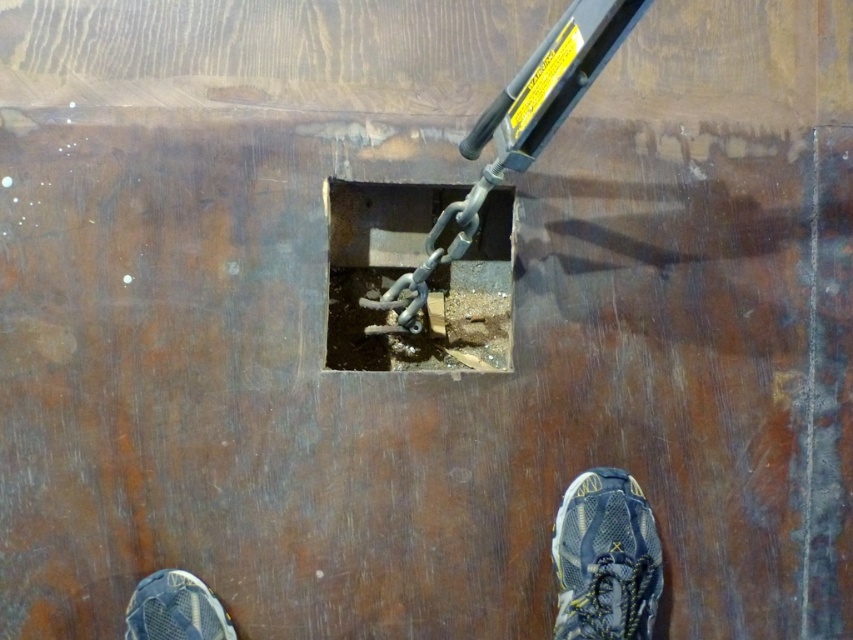
Who is taller, rusty metal hole at center or blue mesh shoe at lower left?

Standing taller between the two is rusty metal hole at center.

Can you confirm if rusty metal hole at center is bigger than blue mesh shoe at lower left?

Yes.

Does point (416, 193) come in front of point (167, 576)?

No, it is not.

At what (x,y) coordinates should I click in order to perform the action: click on rusty metal hole at center. Please return your answer as a coordinate pair (x, y). The width and height of the screenshot is (853, 640). Looking at the image, I should click on (410, 269).

You are a GUI agent. You are given a task and a screenshot of the screen. Output one action in this format:
    pyautogui.click(x=<x>, y=<y>)
    Task: Click on the blue mesh shoe at lower center
    
    Given the screenshot: What is the action you would take?
    pyautogui.click(x=605, y=557)

Who is more distant from viewer, (569,499) or (219,620)?

The point (569,499) is more distant.

Is point (614, 512) behind point (158, 628)?

Yes, point (614, 512) is farther from viewer.

In order to click on blue mesh shoe at lower center in this screenshot , I will do `click(605, 557)`.

Which of these two, blue mesh shoe at lower center or gray mesh shoe at lower right, stands shorter?

Standing shorter between the two is blue mesh shoe at lower center.

Which is in front, point (201, 609) or point (625, 620)?

Positioned in front is point (625, 620).

The height and width of the screenshot is (640, 853). Find the location of `blue mesh shoe at lower center`. blue mesh shoe at lower center is located at coordinates (605, 557).